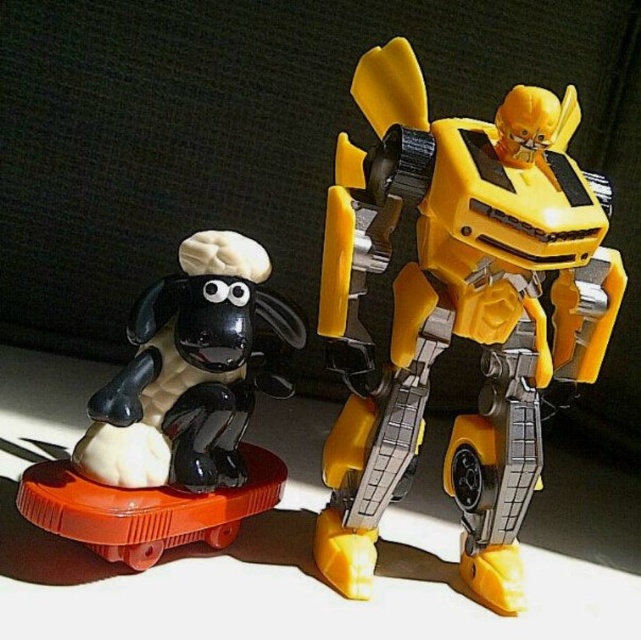
Based on the photo, you are positioning a camera to take a photo of the scene. The camera is currently focused on the center of the image. Which object, the black sheep with chef hat on the left or the yellow plastic robot at upper right, is farther from the camera?

The yellow plastic robot at upper right is located at point (458, 308), which is closer to the camera compared to the black sheep with chef hat on the left. Therefore, the black sheep with chef hat on the left is farther from the camera.

You are setting up a display and want to place both the yellow plastic robot at upper right and the black glossy sheep at left on a shelf. The shelf has a height limit of 12 inches. Can you determine if both items will fit vertically on the shelf based on their sizes?

The yellow plastic robot at upper right is larger in size than the black glossy sheep at left. Since the shelf has a height limit of 12 inches, we need to know the exact height of the robot. However, the description only states that the robot is larger than the sheep but does not provide specific measurements. Without knowing the exact height of the robot, it is impossible to determine if it will fit within the 12 inch limit.

You are a collector who wants to place both the yellow plastic robot at upper right and the black glossy sheep at left into a display case. The case has a width of 30 cm. If the robot is wider than the sheep, can both fit side by side?

The yellow plastic robot at upper right is wider than the black glossy sheep at left. However, since the total width of both objects combined is not provided, it is impossible to determine if they can fit into the 30 cm wide display case without additional information.